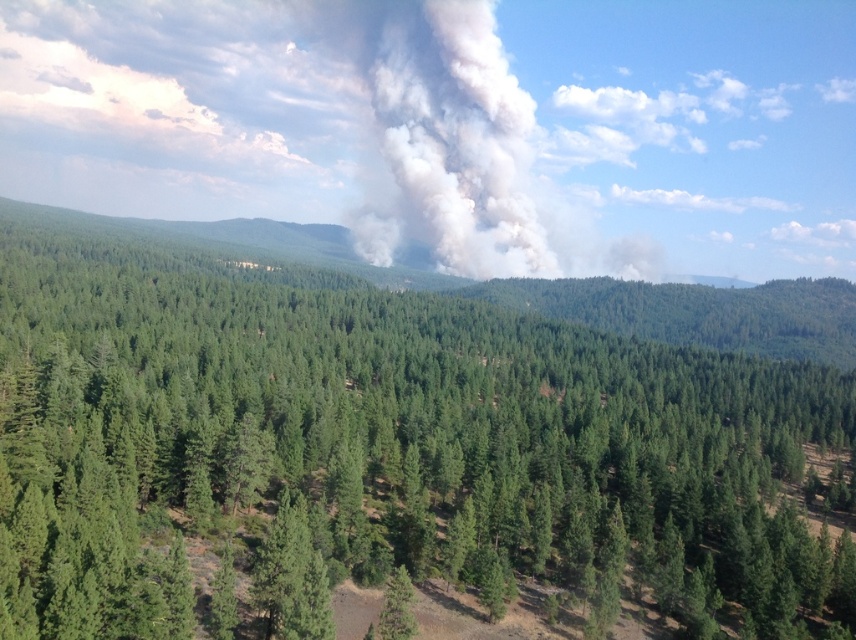
Question: Which point is closer to the camera?

Choices:
 (A) green matte tree at center
 (B) green matte tree at lower center

Answer: (A)

Question: Which of the following is the farthest from the observer?

Choices:
 (A) (330, 278)
 (B) (396, 588)

Answer: (A)

Question: Does green matte tree at center have a smaller size compared to green matte tree at lower center?

Choices:
 (A) yes
 (B) no

Answer: (B)

Question: Is green matte tree at center above green matte tree at lower center?

Choices:
 (A) no
 (B) yes

Answer: (B)

Question: Where is green matte tree at center located in relation to green matte tree at lower center in the image?

Choices:
 (A) above
 (B) below

Answer: (A)